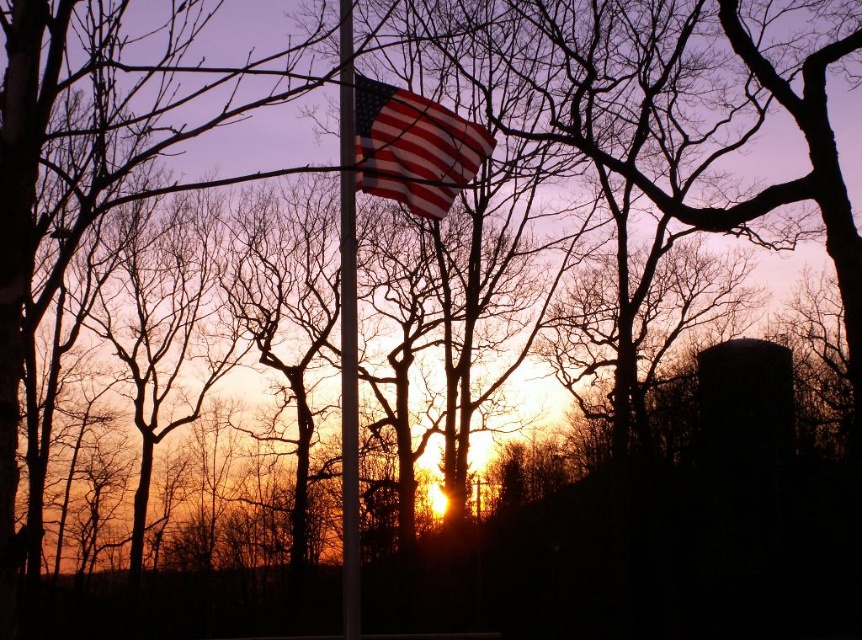
Is american flag at center further to camera compared to metallic pole at center?

That is True.

Who is positioned more to the left, american flag at center or metallic pole at center?

From the viewer's perspective, metallic pole at center appears more on the left side.

Is point (414, 129) farther from camera compared to point (339, 177)?

No, (414, 129) is in front of (339, 177).

This screenshot has height=640, width=862. In order to click on american flag at center in this screenshot , I will do `click(413, 147)`.